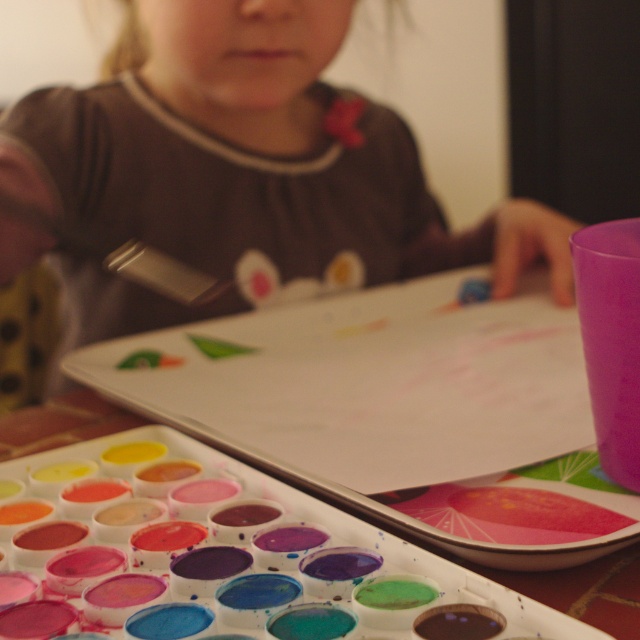
The image size is (640, 640). What do you see at coordinates (218, 540) in the screenshot?
I see `white plastic tray at center` at bounding box center [218, 540].

Who is more distant from viewer, (529, 321) or (134, 275)?

The point (134, 275) is more distant.

Does point (547, 442) come in front of point (132, 241)?

Yes, point (547, 442) is in front of point (132, 241).

I want to click on white plastic tray at center, so point(218,540).

Does matte brown shirt at center have a smaller size compared to white plastic tray at center?

No.

Who is higher up, matte brown shirt at center or white plastic tray at center?

Positioned higher is matte brown shirt at center.

You are a GUI agent. You are given a task and a screenshot of the screen. Output one action in this format:
    pyautogui.click(x=<x>, y=<y>)
    Task: Click on the matte brown shirt at center
    
    Given the screenshot: What is the action you would take?
    pyautogui.click(x=236, y=170)

Based on the photo, is matte brown shirt at center to the right of metallic silver paint brush at upper center from the viewer's perspective?

Indeed, matte brown shirt at center is positioned on the right side of metallic silver paint brush at upper center.

Is point (332, 177) positioned before point (112, 262)?

No, (332, 177) is further to viewer.

Does point (145, 212) come farther from viewer compared to point (196, 288)?

Yes, point (145, 212) is behind point (196, 288).

This screenshot has height=640, width=640. Find the location of `matte brown shirt at center`. matte brown shirt at center is located at coordinates (236, 170).